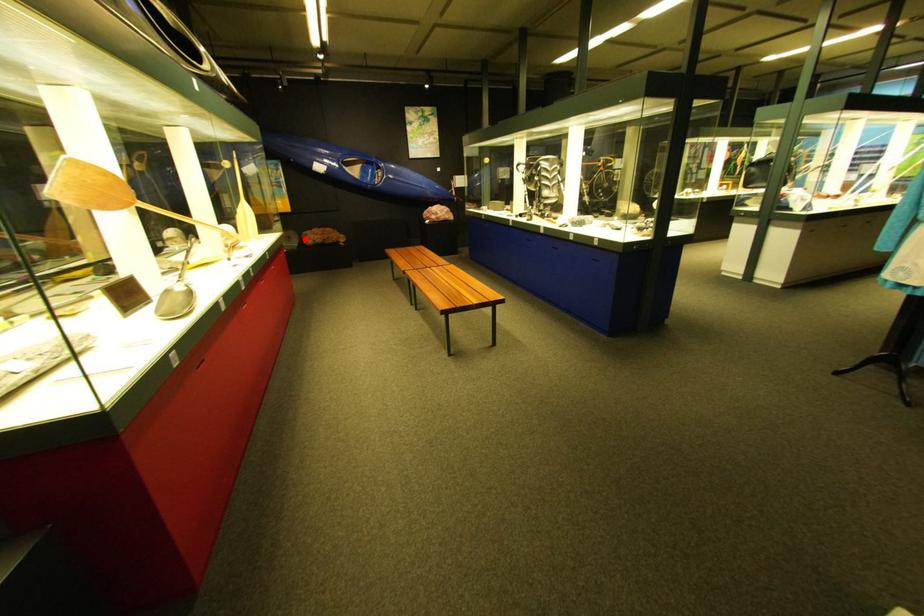
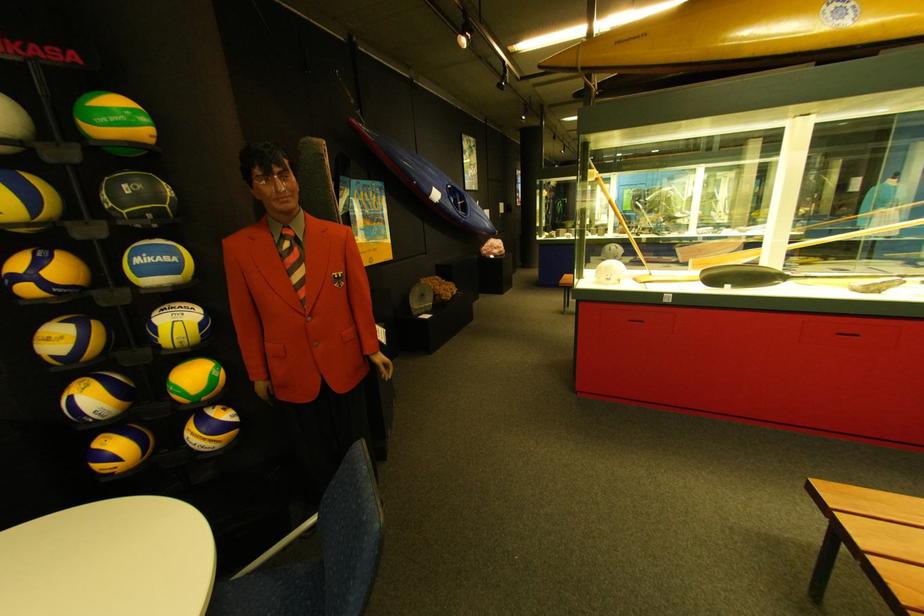
Question: I am providing you with two images of the same scene from different viewpoints. A red point is marked on the first image. At the location where the point appears in image 1, is it still visible in image 2?

Choices:
 (A) Yes
 (B) No

Answer: (A)